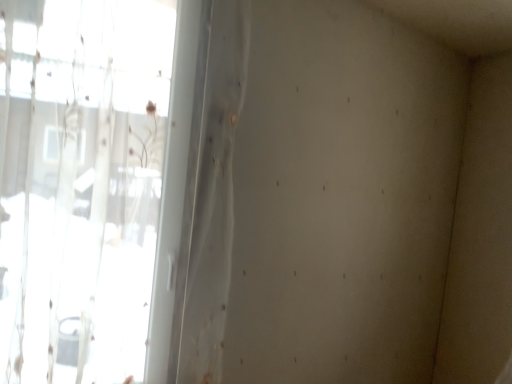
What do you see at coordinates (89, 186) in the screenshot?
I see `transparent fabric at left` at bounding box center [89, 186].

At what (x,y) coordinates should I click in order to perform the action: click on transparent fabric at left. Please return your answer as a coordinate pair (x, y). The image size is (512, 384). Looking at the image, I should click on (89, 186).

Measure the distance between transparent fabric at left and camera.

The depth of transparent fabric at left is 3.72 feet.

You are a GUI agent. You are given a task and a screenshot of the screen. Output one action in this format:
    pyautogui.click(x=<x>, y=<y>)
    Task: Click on the transparent fabric at left
    This screenshot has height=384, width=512.
    Given the screenshot: What is the action you would take?
    pyautogui.click(x=89, y=186)